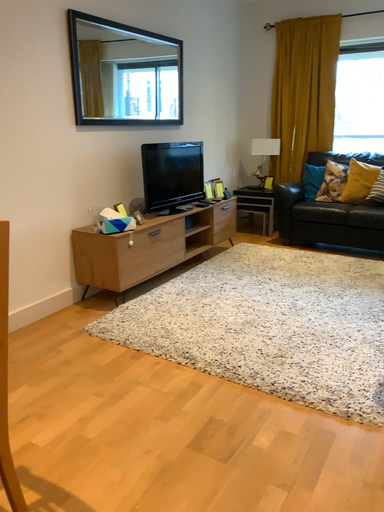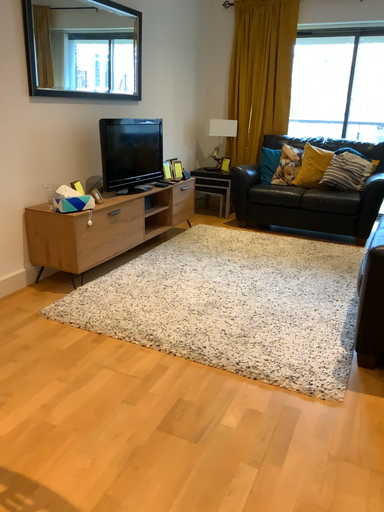
Question: How did the camera likely rotate when shooting the video?

Choices:
 (A) rotated right
 (B) rotated left

Answer: (A)